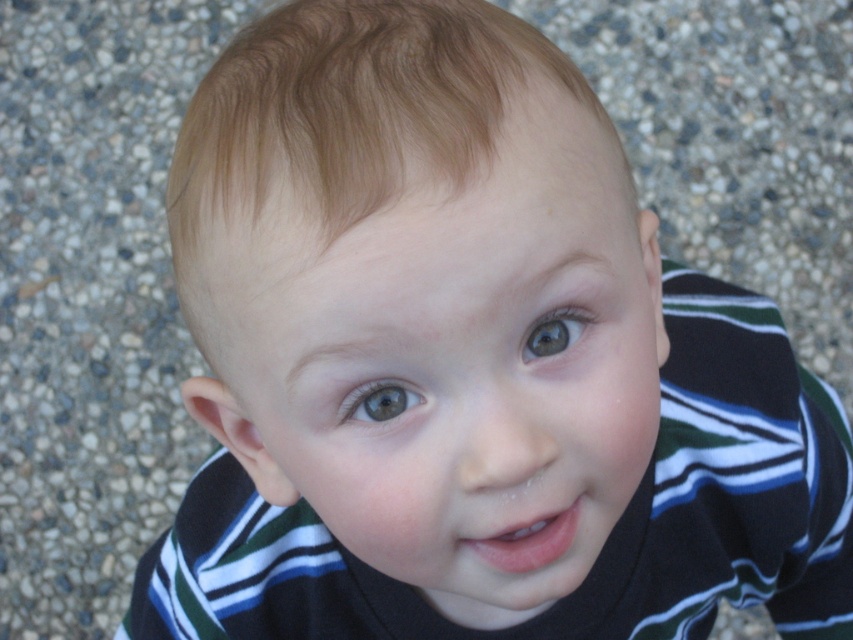
Question: Observing the image, what is the correct spatial positioning of green matte eye at center in reference to blue glossy eye at center?

Choices:
 (A) left
 (B) right

Answer: (B)

Question: Is green matte eye at center to the left of blue glossy eye at center from the viewer's perspective?

Choices:
 (A) no
 (B) yes

Answer: (A)

Question: Which point is farther to the camera?

Choices:
 (A) blue glossy eye at center
 (B) green matte eye at center

Answer: (A)

Question: Can you confirm if green matte eye at center is thinner than blue glossy eye at center?

Choices:
 (A) yes
 (B) no

Answer: (A)

Question: Which of the following is the closest to the observer?

Choices:
 (A) green matte eye at center
 (B) blue glossy eye at center

Answer: (A)

Question: Which point appears closest to the camera in this image?

Choices:
 (A) (358, 397)
 (B) (566, 333)

Answer: (A)